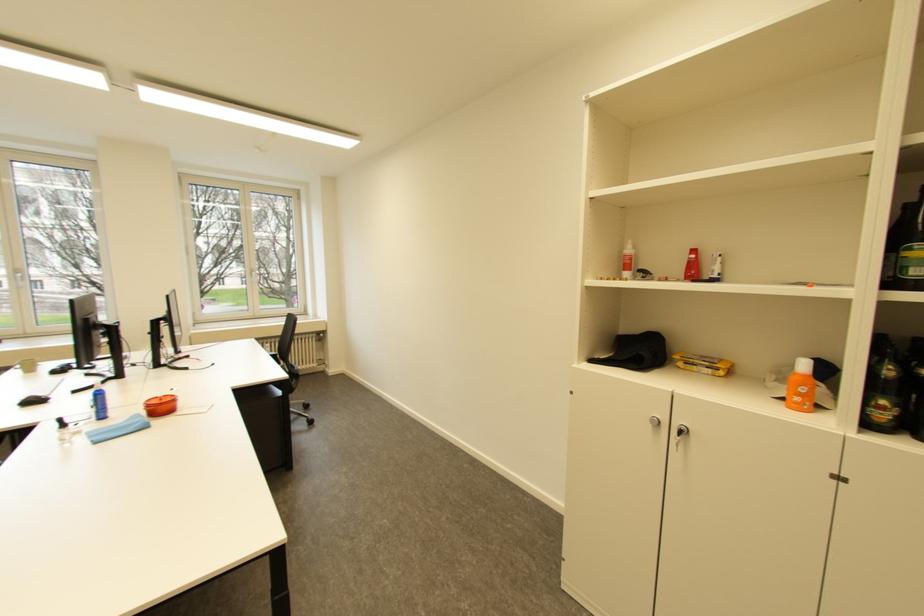
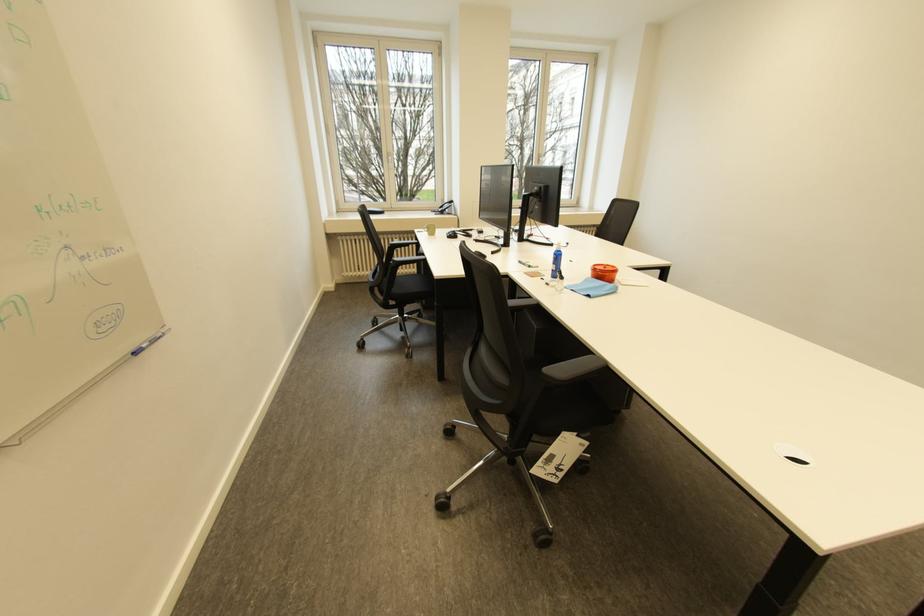
In the second image, find the point that corresponds to the point at 106,418 in the first image.

(562, 276)